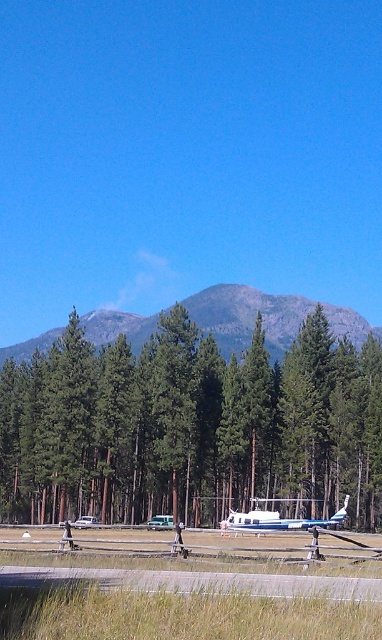
Question: Is gray/dull stone mountain at center positioned in front of metallic blue airplane at center?

Choices:
 (A) no
 (B) yes

Answer: (A)

Question: Which of the following is the closest to the observer?

Choices:
 (A) metallic blue airplane at center
 (B) gray concrete runway at lower center

Answer: (B)

Question: Which point is farther to the camera?

Choices:
 (A) green matte tree at center
 (B) gray concrete runway at lower center
 (C) gray/dull stone mountain at center

Answer: (C)

Question: Which point is farther from the camera taking this photo?

Choices:
 (A) click(338, 513)
 (B) click(302, 371)
 (C) click(150, 324)

Answer: (C)

Question: Can you confirm if green matte tree at center is wider than gray concrete runway at lower center?

Choices:
 (A) no
 (B) yes

Answer: (B)

Question: Is green matte tree at center smaller than gray/dull stone mountain at center?

Choices:
 (A) no
 (B) yes

Answer: (B)